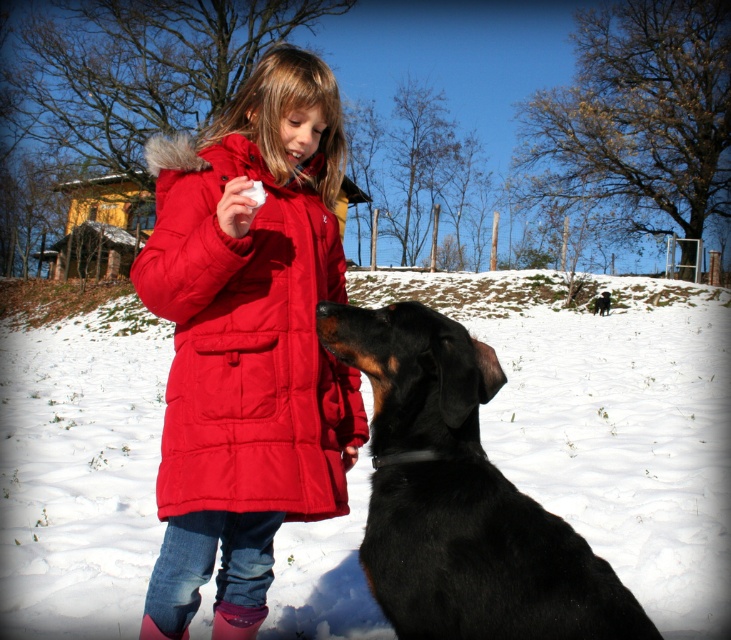
You are a photographer trying to capture the girl and her dog in the winter scene. Based on the image, can you determine if the white fluffy snow at center is wider than the matte red coat at center?

The white fluffy snow at center might be wider than matte red coat at center according to the description.

What is the exact coordinate of the white fluffy snow at center?

The white fluffy snow at center is located at point [607,420].

You are a photographer trying to capture the girl and her dog in the snow. To ensure both the girl and the dog are in focus, you need to adjust your camera settings. Considering the white fluffy snow at center and the black smooth fur dog at lower right, which object is taller and requires more depth of field?

The white fluffy snow at center is taller than the black smooth fur dog at lower right, so you should adjust the camera settings to accommodate the height difference for proper focus on both subjects.